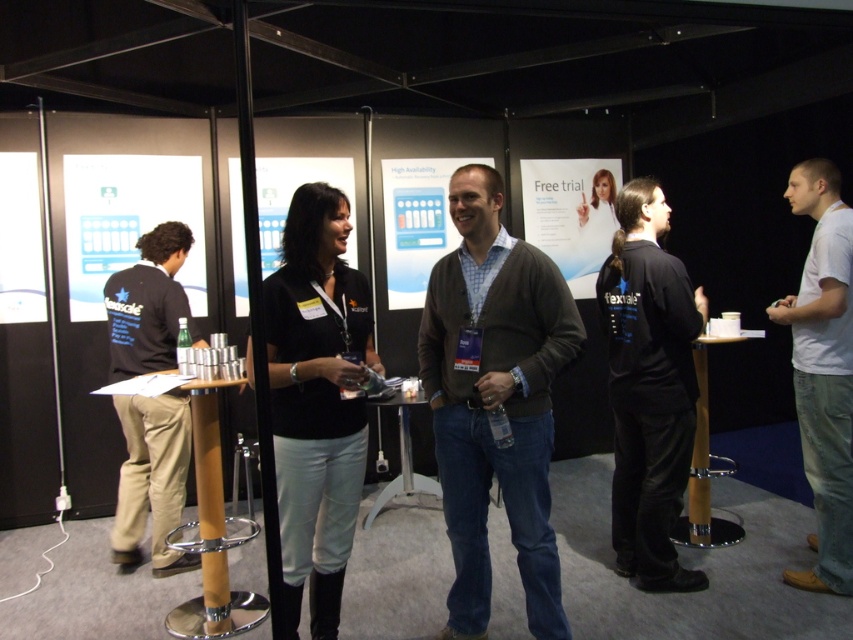
Question: Which point is closer to the camera?

Choices:
 (A) white cotton shirt at right
 (B) khaki cotton pants at left
 (C) black fabric shirt at center
 (D) matte brown cardigan at center

Answer: (D)

Question: Where is white cotton shirt at right located in relation to khaki cotton pants at left in the image?

Choices:
 (A) right
 (B) left

Answer: (A)

Question: Can you confirm if black fabric shirt at center is bigger than khaki cotton pants at left?

Choices:
 (A) no
 (B) yes

Answer: (A)

Question: Is black fabric shirt at center in front of khaki cotton pants at left?

Choices:
 (A) yes
 (B) no

Answer: (A)

Question: Which point is farther to the camera?

Choices:
 (A) tap(538, 472)
 (B) tap(141, 333)
 (C) tap(666, 220)
 (D) tap(816, 179)

Answer: (B)

Question: Which point is closer to the camera taking this photo?

Choices:
 (A) (465, 580)
 (B) (151, 339)
 (C) (848, 358)
 (D) (616, 282)

Answer: (A)